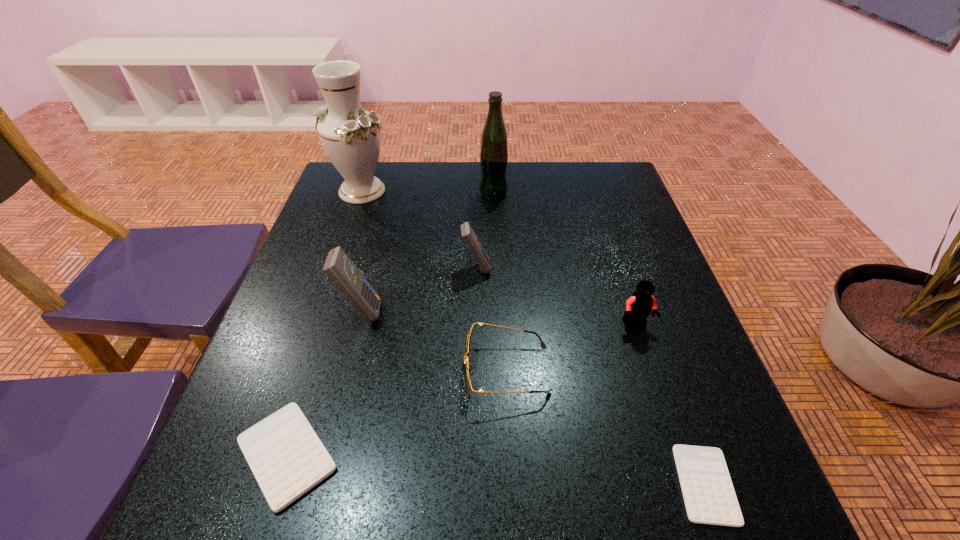
Image resolution: width=960 pixels, height=540 pixels. Identify the location of the tallest object. (351, 138).

The width and height of the screenshot is (960, 540). What are the coordinates of `beer bottle` in the screenshot? It's located at (494, 145).

Locate an element on the screen. Image resolution: width=960 pixels, height=540 pixels. the second tallest object is located at coordinates (494, 145).

Identify the location of the third tallest object. Image resolution: width=960 pixels, height=540 pixels. (338, 267).

You are a GUI agent. You are given a task and a screenshot of the screen. Output one action in this format:
    pyautogui.click(x=<x>, y=<y>)
    Task: Click on the left blue calculator
    The width and height of the screenshot is (960, 540).
    Given the screenshot: What is the action you would take?
    pyautogui.click(x=338, y=267)

Locate an element on the screen. The height and width of the screenshot is (540, 960). the right blue calculator is located at coordinates (468, 234).

I want to click on the farthest calculator, so click(x=468, y=234).

You are a GUI agent. You are given a task and a screenshot of the screen. Output one action in this format:
    pyautogui.click(x=<x>, y=<y>)
    Task: Click on the Lego
    This screenshot has height=540, width=960.
    Given the screenshot: What is the action you would take?
    pyautogui.click(x=639, y=305)

This screenshot has width=960, height=540. Find the location of `black sunglasses`. black sunglasses is located at coordinates (468, 368).

Identify the location of the sixth tallest object. The width and height of the screenshot is (960, 540). (468, 368).